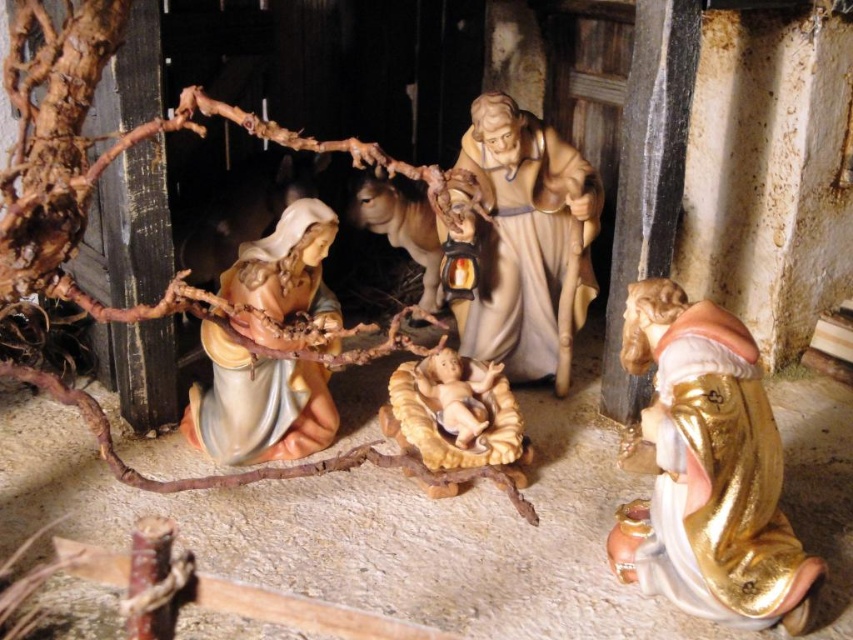
Looking at this image, you are an observer standing in front of the nativity scene. You see the gold glossy statue at lower right and the matte wood figure at center. Which object is positioned closer to you?

The gold glossy statue at lower right is closer to the viewer than the matte wood figure at center.

In the nativity scene, you see a gold glossy statue at lower right and a matte wood figure at center. Which one is positioned to the east side of the other?

The gold glossy statue at lower right is to the east of the matte wood figure at center.